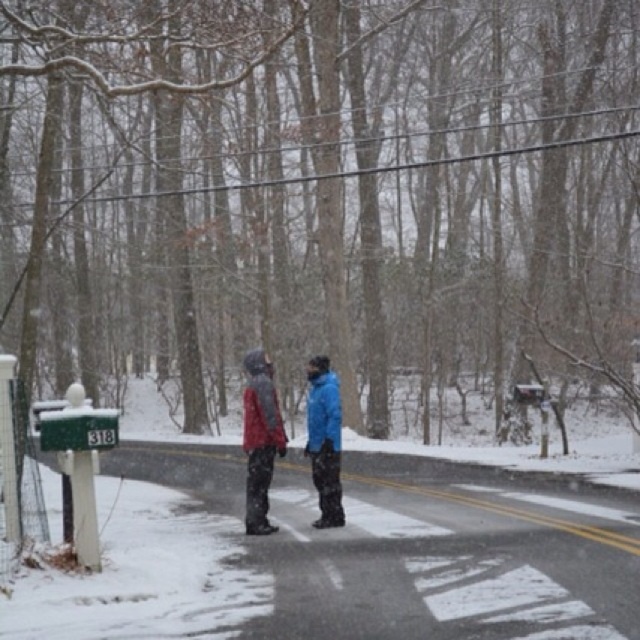
Based on the photo, which of these two, green painted metal mailbox at lower left or matte gray jacket at center, stands taller?

green painted metal mailbox at lower left is taller.

Who is shorter, green painted metal mailbox at lower left or matte gray jacket at center?

matte gray jacket at center is shorter.

You are a GUI agent. You are given a task and a screenshot of the screen. Output one action in this format:
    pyautogui.click(x=<x>, y=<y>)
    Task: Click on the green painted metal mailbox at lower left
    
    Given the screenshot: What is the action you would take?
    pyautogui.click(x=80, y=461)

Can you confirm if matte blue jacket at center is positioned to the right of matte gray jacket at center?

No, matte blue jacket at center is not to the right of matte gray jacket at center.

Who is more distant from viewer, (332, 468) or (273, 458)?

Point (332, 468)

What are the coordinates of `matte blue jacket at center` in the screenshot? It's located at (260, 438).

The height and width of the screenshot is (640, 640). Find the location of `matte blue jacket at center`. matte blue jacket at center is located at coordinates (260, 438).

Can you confirm if matte blue jacket at center is smaller than blue matte jacket at center?

Actually, matte blue jacket at center might be larger than blue matte jacket at center.

Can you confirm if matte blue jacket at center is thinner than blue matte jacket at center?

No.

Does point (259, 451) come closer to viewer compared to point (314, 422)?

Yes, it is in front of point (314, 422).

You are a GUI agent. You are given a task and a screenshot of the screen. Output one action in this format:
    pyautogui.click(x=<x>, y=<y>)
    Task: Click on the matte blue jacket at center
    This screenshot has height=640, width=640.
    Given the screenshot: What is the action you would take?
    pyautogui.click(x=260, y=438)